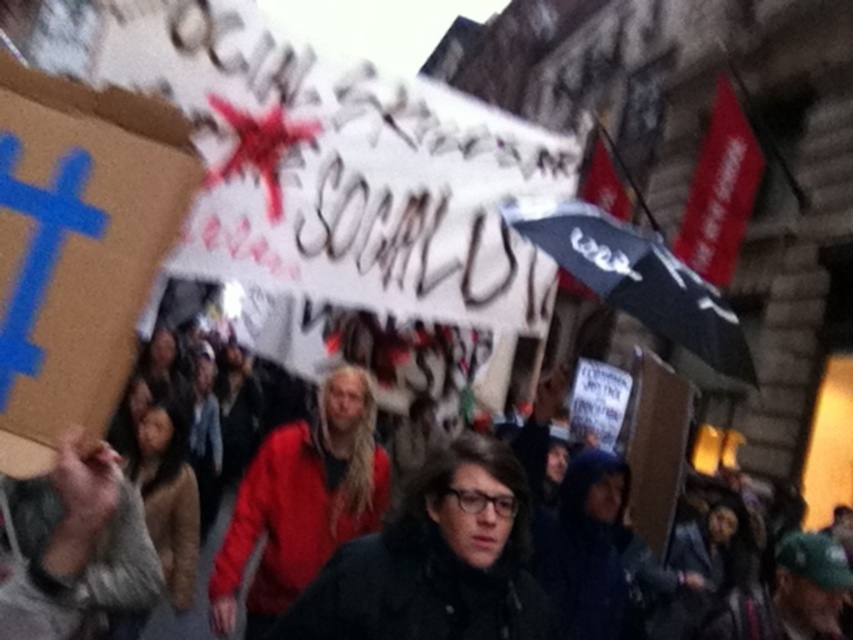
Is black matte umbrella at upper right below black fabric crowd at center?

Incorrect, black matte umbrella at upper right is not positioned below black fabric crowd at center.

Describe the element at coordinates (637, 278) in the screenshot. I see `black matte umbrella at upper right` at that location.

Where is `black matte umbrella at upper right`? black matte umbrella at upper right is located at coordinates (637, 278).

How far apart are red jacket at center and black fabric crowd at center?

A distance of 2.23 meters exists between red jacket at center and black fabric crowd at center.

You are a GUI agent. You are given a task and a screenshot of the screen. Output one action in this format:
    pyautogui.click(x=<x>, y=<y>)
    Task: Click on the red jacket at center
    Image resolution: width=853 pixels, height=640 pixels.
    Given the screenshot: What is the action you would take?
    pyautogui.click(x=300, y=502)

Identify the location of red jacket at center. (300, 502).

Is red jacket at center closer to the viewer compared to black matte umbrella at upper right?

No, red jacket at center is further to the viewer.

Between point (259, 564) and point (589, 253), which one is positioned in front?

Point (589, 253) is in front.

This screenshot has width=853, height=640. Find the location of `red jacket at center`. red jacket at center is located at coordinates (300, 502).